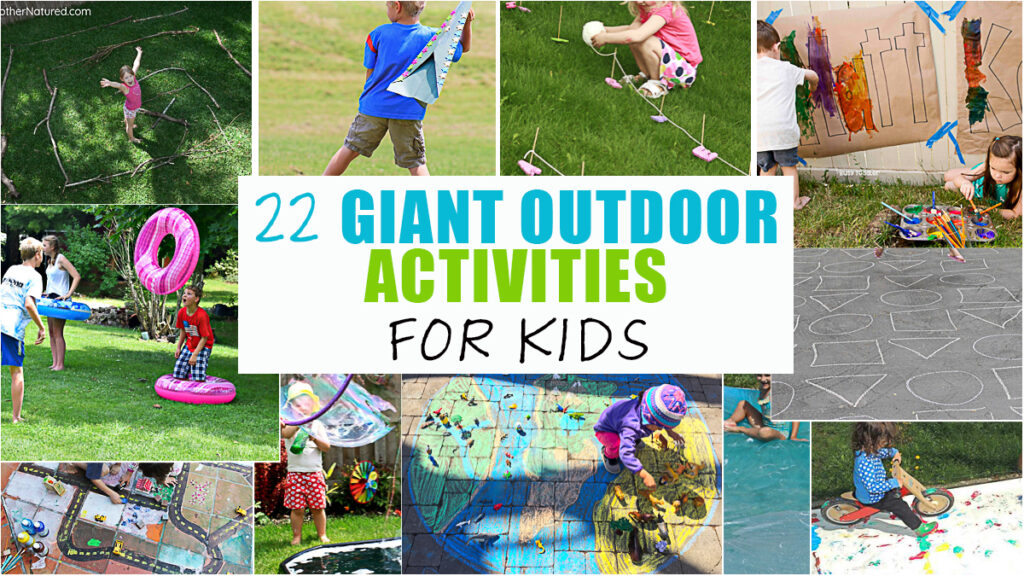
The image size is (1024, 576). I want to click on map, so click(x=560, y=465).